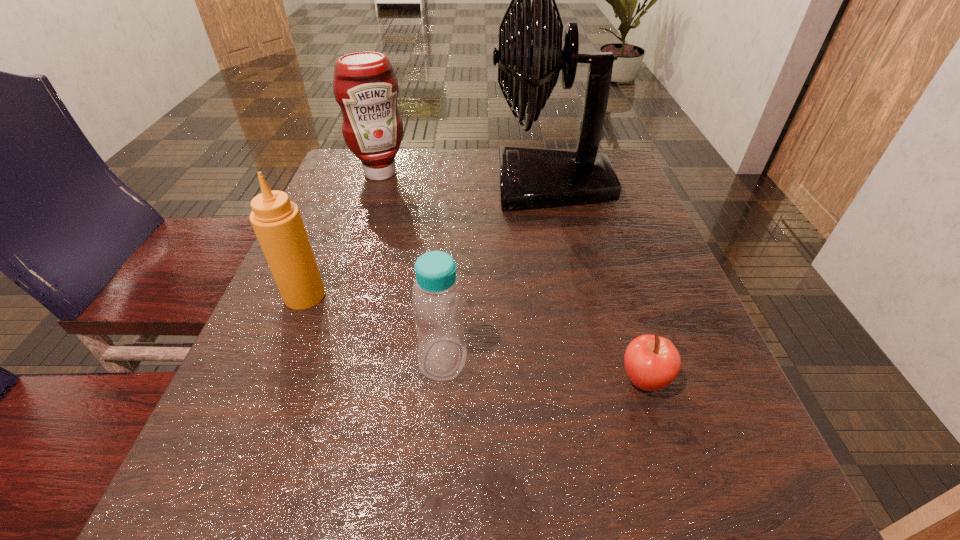
Find the location of a particular element. fan is located at coordinates (530, 56).

Locate an element on the screen. Image resolution: width=960 pixels, height=540 pixels. the farther condiment is located at coordinates (365, 86).

Identify the location of the third farthest object. (277, 222).

At what (x,y) coordinates should I click in order to perform the action: click on the third object from left to right. Please return your answer as a coordinate pair (x, y). The height and width of the screenshot is (540, 960). Looking at the image, I should click on (437, 296).

Locate an element on the screen. bottle is located at coordinates (437, 296).

What are the coordinates of `apple` in the screenshot? It's located at (652, 362).

Locate an element on the screen. This screenshot has height=540, width=960. free space located 0.370m in front of the fan to blow air is located at coordinates (344, 185).

This screenshot has height=540, width=960. Identify the location of vacant region located 0.300m in front of the fan to blow air. (372, 185).

This screenshot has height=540, width=960. I want to click on vacant area situated in front of the fan to blow air, so click(383, 185).

This screenshot has height=540, width=960. Find the location of `vacant area situated on the right of the farther condiment`. vacant area situated on the right of the farther condiment is located at coordinates (476, 173).